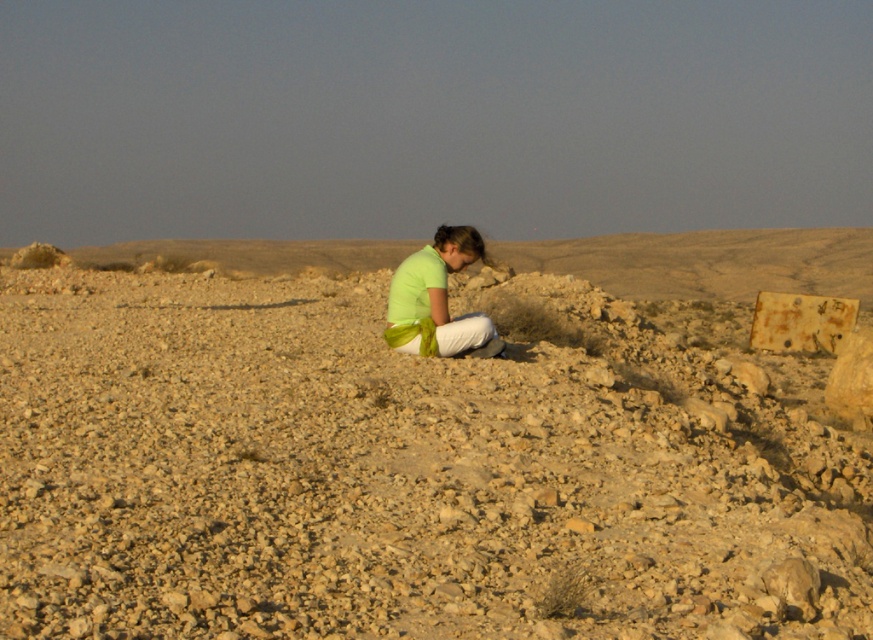
The width and height of the screenshot is (873, 640). What are the coordinates of `brown rocky dirt at center` in the screenshot? It's located at (411, 468).

The width and height of the screenshot is (873, 640). In order to click on brown rocky dirt at center in this screenshot , I will do `click(411, 468)`.